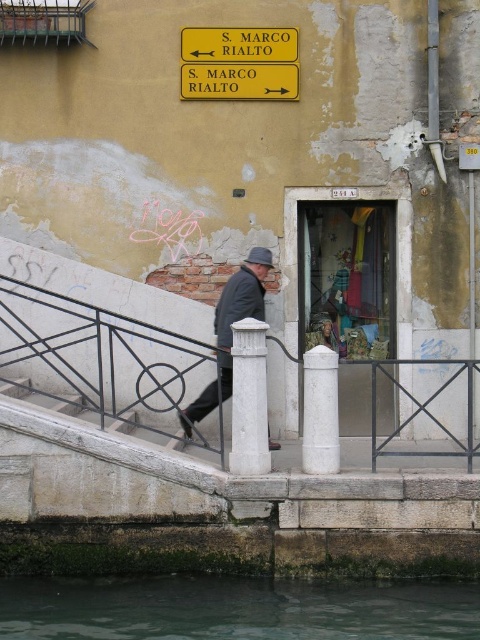
Question: Is yellowmaterial/texturestreet sign at upper center bigger than yellow/yellowish paper at upper center?

Choices:
 (A) no
 (B) yes

Answer: (A)

Question: Among these objects, which one is farthest from the camera?

Choices:
 (A) yellowmaterial/texturestreet sign at upper center
 (B) white stone post at center
 (C) matte gray coat at center

Answer: (A)

Question: Does greenish water at lower left appear under white smooth pillar at lower center?

Choices:
 (A) no
 (B) yes

Answer: (B)

Question: Which point appears farthest from the camera in this image?

Choices:
 (A) (211, 83)
 (B) (271, 262)
 (C) (60, 616)

Answer: (A)

Question: Observing the image, what is the correct spatial positioning of white stone post at center in reference to yellowmaterial/texturestreet sign at upper center?

Choices:
 (A) left
 (B) right

Answer: (B)

Question: Which point is closer to the camera?

Choices:
 (A) (213, 369)
 (B) (60, 595)
 (C) (245, 70)

Answer: (B)